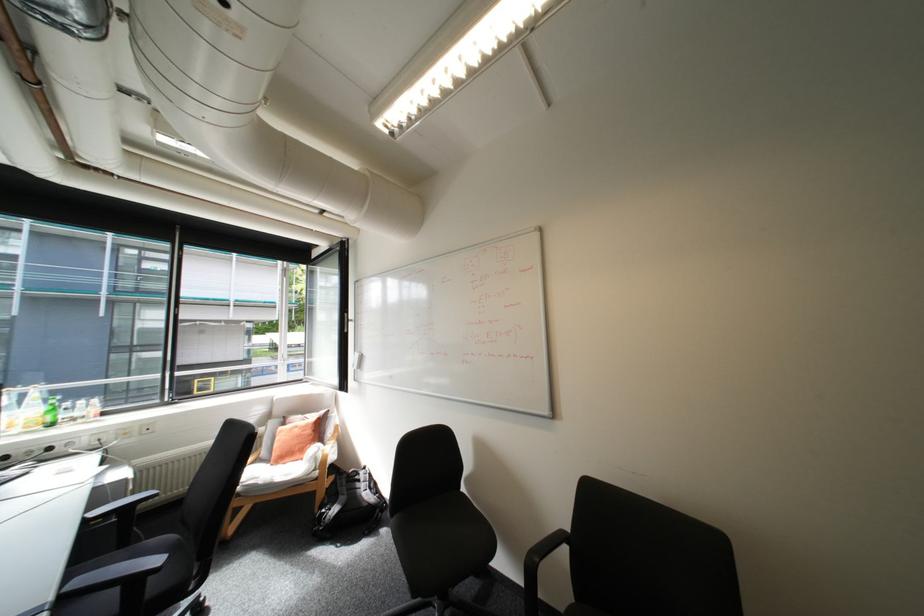
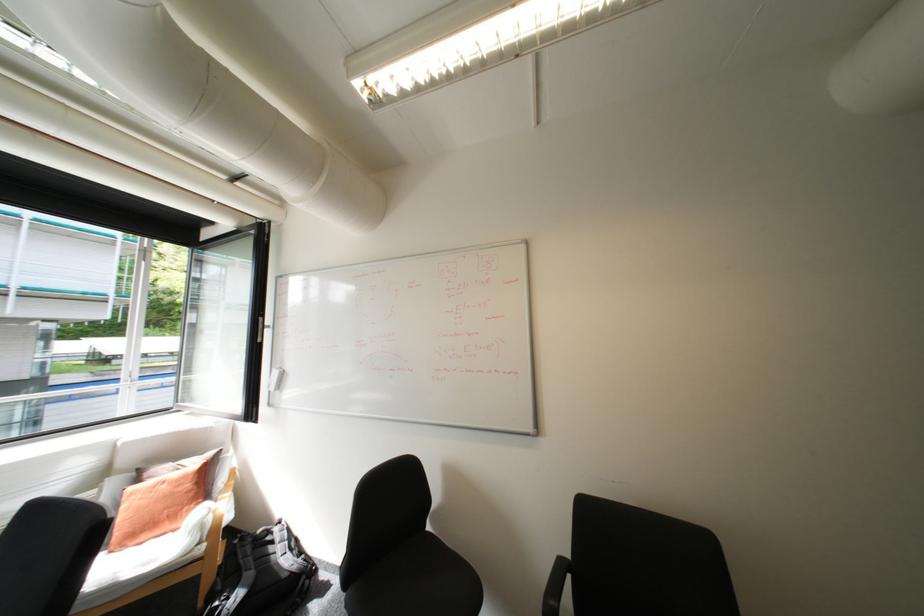
Which direction would the cameraman need to move to produce the second image?

The cameraman walked toward left, forward.